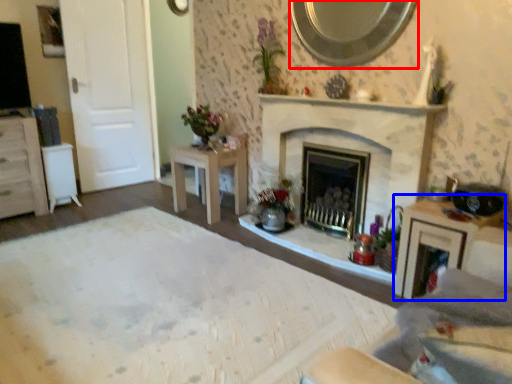
Question: Which object is closer to the camera taking this photo, mirror (highlighted by a red box) or vanity (highlighted by a blue box)?

Choices:
 (A) mirror
 (B) vanity

Answer: (B)